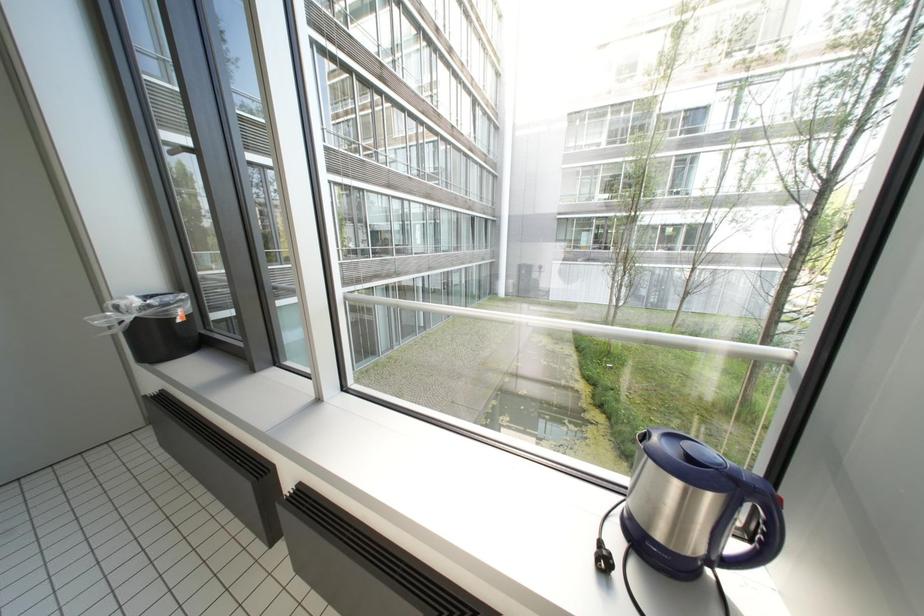
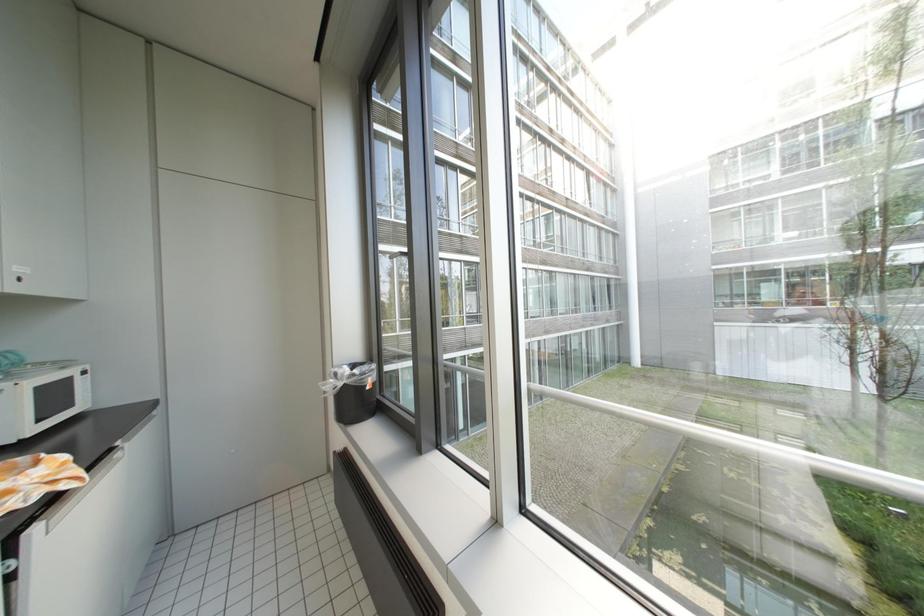
Question: What movement of the cameraman would produce the second image?

Choices:
 (A) Left
 (B) Right
 (C) Forward
 (D) Backward

Answer: (A)